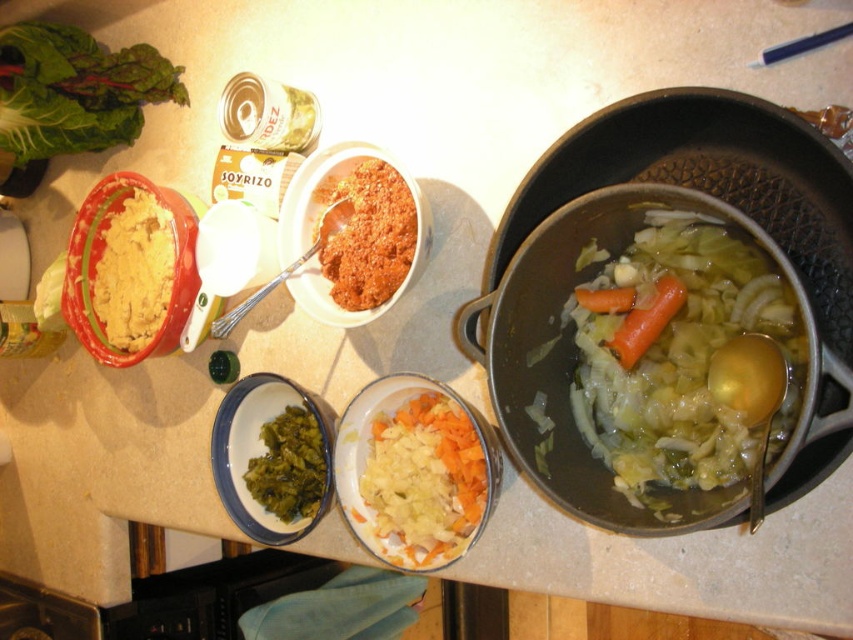
Can you confirm if matte black pot at center is positioned above orange smooth carrot at center?

Correct, matte black pot at center is located above orange smooth carrot at center.

Who is shorter, matte black pot at center or orange smooth carrot at center?

Result: With less height is orange smooth carrot at center.

The height and width of the screenshot is (640, 853). Find the location of `matte black pot at center`. matte black pot at center is located at coordinates (624, 244).

Who is shorter, translucent glass bowl at center or yellow mashed potato at left?

yellow mashed potato at left

Is point (720, 371) more distant than point (138, 310)?

No, (720, 371) is closer to viewer.

This screenshot has width=853, height=640. I want to click on translucent glass bowl at center, so click(x=682, y=356).

Between matte black pot at center and green leafy material/texture at position, which one has more height?

With more height is matte black pot at center.

Identify the location of matte black pot at center. This screenshot has height=640, width=853. (624, 244).